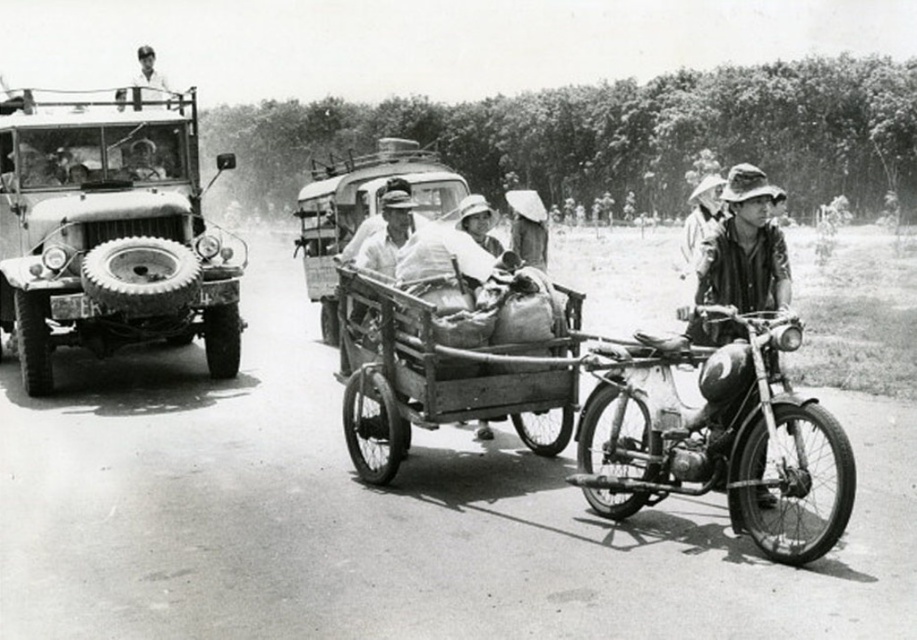
Question: Does rusty metal jeep at left appear on the left side of wooden cart at center?

Choices:
 (A) yes
 (B) no

Answer: (A)

Question: Which point is farther to the camera?

Choices:
 (A) shiny chrome motorcycle at center right
 (B) wooden cart at center

Answer: (B)

Question: Is shiny chrome motorcycle at center right above light-colored shirt at upper left?

Choices:
 (A) yes
 (B) no

Answer: (B)

Question: In this image, where is rusty metal jeep at left located relative to shiny chrome motorcycle at center right?

Choices:
 (A) below
 (B) above

Answer: (B)

Question: Which of the following is the farthest from the observer?

Choices:
 (A) (791, 422)
 (B) (85, 252)
 (C) (726, 250)
 (D) (456, 324)

Answer: (B)

Question: Among these objects, which one is nearest to the camera?

Choices:
 (A) matte black motorcycle at right
 (B) rusty metal jeep at left

Answer: (A)